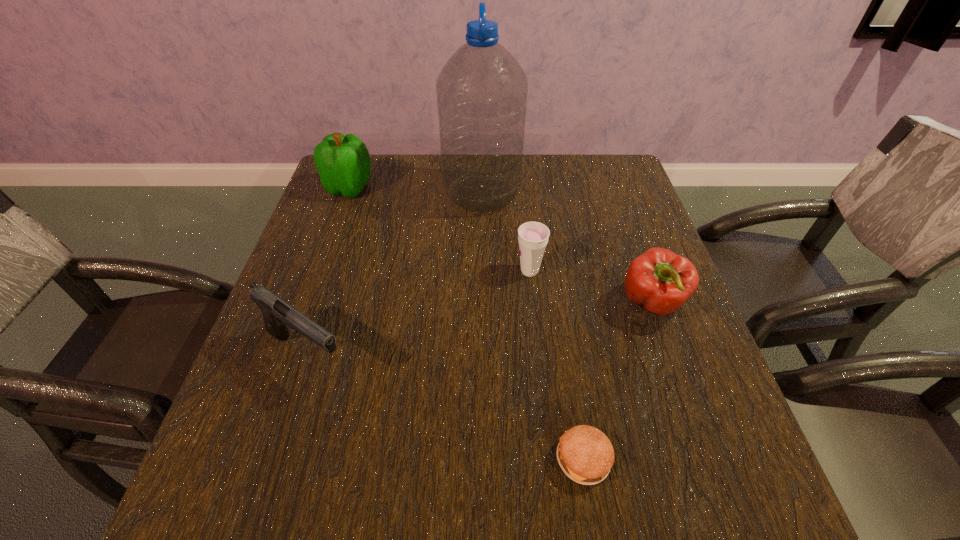
Find the location of `object present at the right edge`. object present at the right edge is located at coordinates (660, 281).

Locate an element on the screen. This screenshot has width=960, height=540. object located in the far left corner section of the desktop is located at coordinates (343, 162).

Locate an element on the screen. Image resolution: width=960 pixels, height=540 pixels. vacant region at the near edge of the desktop is located at coordinates (641, 474).

The height and width of the screenshot is (540, 960). I want to click on vacant space at the left edge of the desktop, so click(x=352, y=242).

Find the location of `vacant area at the right edge`. vacant area at the right edge is located at coordinates (674, 450).

Find the location of `vacant area at the near left corner`. vacant area at the near left corner is located at coordinates (239, 499).

This screenshot has width=960, height=540. What are the coordinates of `vacant area at the far right corner` in the screenshot? It's located at (588, 170).

Where is `free space that is in between the taller bell pepper and the hamburger`? This screenshot has height=540, width=960. free space that is in between the taller bell pepper and the hamburger is located at coordinates (467, 323).

Find the location of a particular element. Image resolution: width=960 pixels, height=540 pixels. free spot between the rightmost object and the gun is located at coordinates (479, 329).

Identify the location of free spot between the farther bell pepper and the hamburger. Image resolution: width=960 pixels, height=540 pixels. (467, 323).